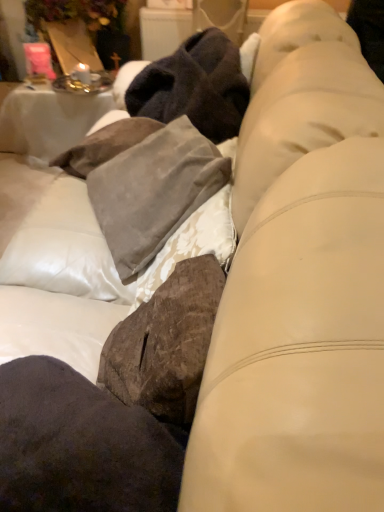
Question: Is dark brown suede pillow at lower left bigger than suede pillow at center?

Choices:
 (A) no
 (B) yes

Answer: (A)

Question: Considering the relative positions of dark brown suede pillow at lower left and suede pillow at center in the image provided, is dark brown suede pillow at lower left to the left of suede pillow at center from the viewer's perspective?

Choices:
 (A) yes
 (B) no

Answer: (A)

Question: Can you confirm if dark brown suede pillow at lower left is wider than suede pillow at center?

Choices:
 (A) no
 (B) yes

Answer: (B)

Question: Is suede pillow at center completely or partially inside dark brown suede pillow at lower left?

Choices:
 (A) no
 (B) yes

Answer: (A)

Question: From the image's perspective, is dark brown suede pillow at lower left beneath suede pillow at center?

Choices:
 (A) no
 (B) yes

Answer: (B)

Question: Is suede pillow at center to the left or to the right of dark brown suede pillow at lower left in the image?

Choices:
 (A) right
 (B) left

Answer: (A)

Question: Is suede pillow at center in front of or behind dark brown suede pillow at lower left in the image?

Choices:
 (A) front
 (B) behind

Answer: (B)

Question: Which is correct: suede pillow at center is inside dark brown suede pillow at lower left, or outside of it?

Choices:
 (A) inside
 (B) outside

Answer: (B)

Question: Looking at their shapes, would you say suede pillow at center is wider or thinner than dark brown suede pillow at lower left?

Choices:
 (A) thin
 (B) wide

Answer: (A)

Question: Considering the relative positions of dark brown suede pillow at lower left and suede pillow at center in the image provided, is dark brown suede pillow at lower left to the left or to the right of suede pillow at center?

Choices:
 (A) right
 (B) left

Answer: (B)

Question: Considering the positions of dark brown suede pillow at lower left and suede pillow at center in the image, is dark brown suede pillow at lower left taller or shorter than suede pillow at center?

Choices:
 (A) short
 (B) tall

Answer: (A)

Question: Relative to suede pillow at center, is dark brown suede pillow at lower left in front or behind?

Choices:
 (A) front
 (B) behind

Answer: (A)

Question: Considering the positions of dark brown suede pillow at lower left and suede pillow at center in the image, is dark brown suede pillow at lower left bigger or smaller than suede pillow at center?

Choices:
 (A) big
 (B) small

Answer: (B)

Question: Is point (89, 170) positioned closer to the camera than point (94, 111)?

Choices:
 (A) farther
 (B) closer

Answer: (B)

Question: From a real-world perspective, is suede pillow at center positioned above or below white clothed table at upper left?

Choices:
 (A) above
 (B) below

Answer: (A)